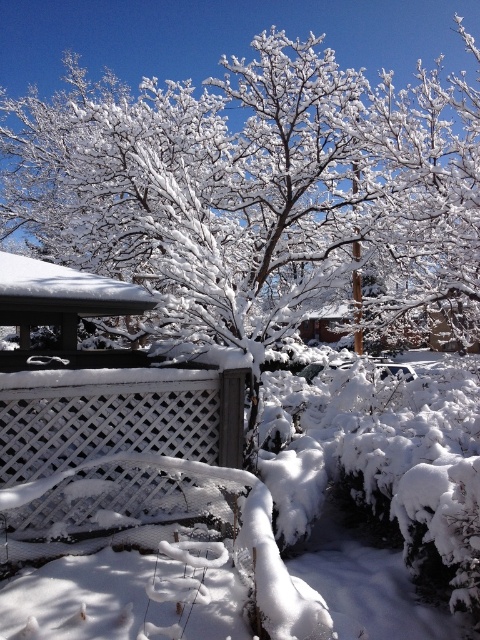
You are a photographer positioned at the center of the winter scene. You want to capture both the point at coordinates point (386, 96) and point (62, 410) in your shot. Which point is closer to your camera lens?

Point (386, 96) is further to the viewer than point (62, 410), so the point closer to the camera lens is point (62, 410).

You are standing in the winter scene and want to walk towards the white frosty tree at center and the white lattice fence at center. Which object will you encounter first?

You will encounter the white frosty tree at center first because it is closer to you than the white lattice fence at center, which is further away.

Looking at this image, you are an artist planning to paint the winter scene. You want to ensure the white frosty tree at center and the white lattice fence at center are proportionally accurate. Which object should you draw larger in your painting?

The white frosty tree at center should be drawn larger than the white lattice fence at center because the description states it is bigger.